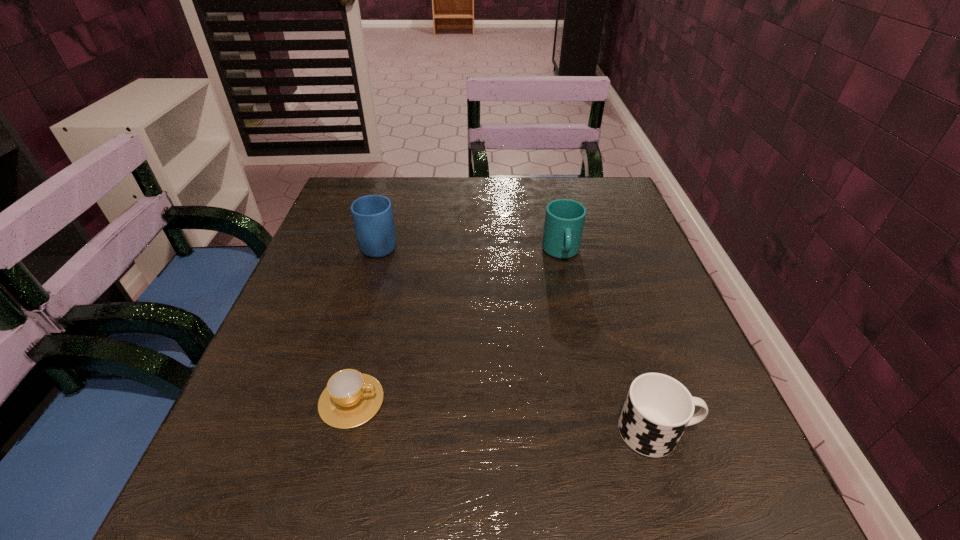
The width and height of the screenshot is (960, 540). I want to click on free space located with the handle on the side of the shortest object, so click(x=542, y=401).

You are a GUI agent. You are given a task and a screenshot of the screen. Output one action in this format:
    pyautogui.click(x=<x>, y=<y>)
    Task: Click on the mug situated at the left edge
    
    Given the screenshot: What is the action you would take?
    pyautogui.click(x=372, y=215)

Where is `cup situated at the left edge`? cup situated at the left edge is located at coordinates (351, 398).

Find the location of `object that is at the right edge`. object that is at the right edge is located at coordinates (658, 408).

In the image, there is a desktop. Identify the location of vacant space at the far edge. (468, 192).

In order to click on vacant space at the near edge of the desktop in this screenshot , I will do 554,482.

The image size is (960, 540). I want to click on free location at the left edge of the desktop, so click(x=355, y=294).

Find the location of a particular element. Image resolution: width=960 pixels, height=540 pixels. blank space at the right edge of the desktop is located at coordinates (686, 383).

In the image, there is a desktop. At what (x,y) coordinates should I click in order to perform the action: click on free space at the far left corner. Please return your answer as a coordinate pair (x, y). The height and width of the screenshot is (540, 960). Looking at the image, I should click on (357, 187).

The width and height of the screenshot is (960, 540). In the image, there is a desktop. Identify the location of vacant space at the near left corner. (222, 482).